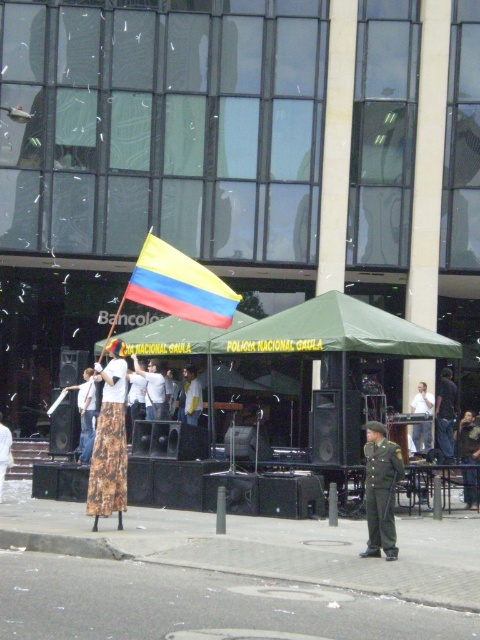
What are the coordinates of the dark blue uniform at center?

The dark blue uniform at center is located at point (445, 413).

You are an event organizer and need to decide which item to move first to make space for a new banner. Since the printed fabric skirt at center is taller than the light brown leather jacket at center, which one should you move first to avoid blocking the banner?

The printed fabric skirt at center should be moved first because it is taller than the light brown leather jacket at center and would block the banner more if left in place.

You are standing at the point with coordinates point (x=96, y=445) and want to walk towards the building. Will you pass by point (x=160, y=419) on your way?

Point (x=96, y=445) is in front of point (x=160, y=419), so if you are at point (x=96, y=445) and walk towards the building, you will not pass by point (x=160, y=419) because it is behind you.